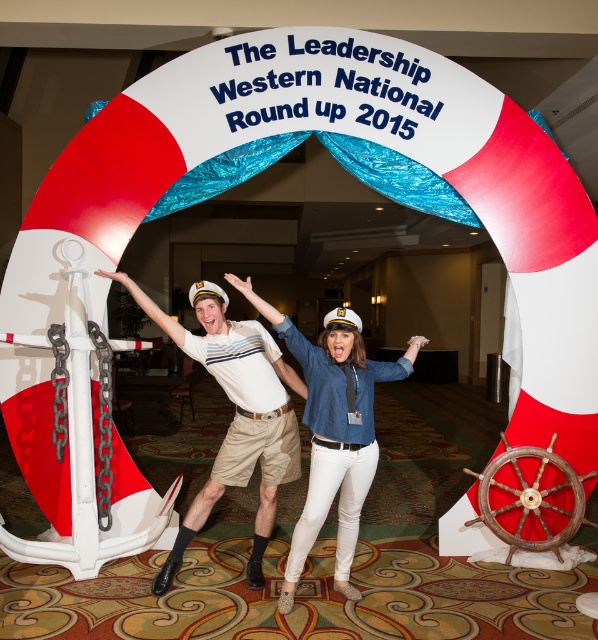
Is point (193, 355) behind point (337, 381)?

Yes, point (193, 355) is behind point (337, 381).

Between white cotton shirt at center and denim shirt at center, which one has more height?

With more height is white cotton shirt at center.

Where is `white cotton shirt at center`? This screenshot has width=598, height=640. white cotton shirt at center is located at coordinates (236, 416).

Identify the location of white cotton shirt at center. This screenshot has width=598, height=640. (236, 416).